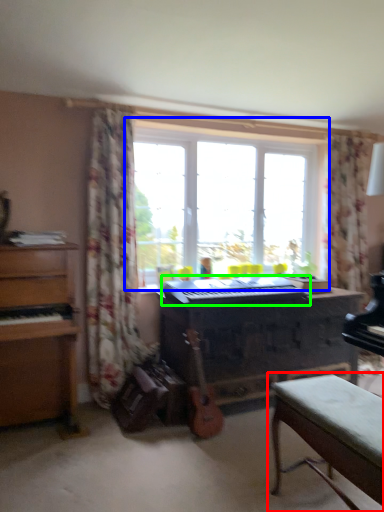
Question: Based on their relative distances, which object is nearer to table (highlighted by a red box)? Choose from window (highlighted by a blue box) and musical keyboard (highlighted by a green box).

Choices:
 (A) window
 (B) musical keyboard

Answer: (B)